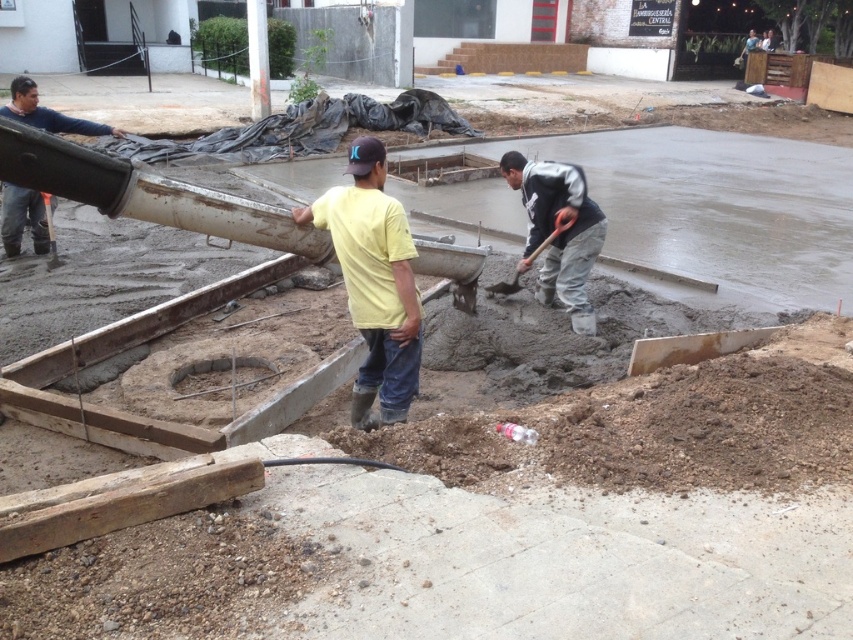
Looking at this image, you are a construction inspector examining the site from a safe distance. You notice two points marked on the concrete pour area. Which point, point [352,227] or point [587,333], is closer to your current position?

Point [352,227] is closer to the camera than point [587,333], so the point closer to your position is point [352,227].

You are a safety inspector at the construction site. You notice the yellow matte shirt at center and the gray concrete shovel at center. Which object is taller?

The yellow matte shirt at center is taller than the gray concrete shovel at center.

You are a safety inspector at the construction site. You need to ensure that the yellow matte shirt at center and the metallic gray shovel at center are visible to each other. Since the yellow matte shirt is wider than the shovel, which object would block the other from view if positioned directly in front?

The yellow matte shirt at center is wider than the metallic gray shovel at center, so if positioned directly in front, the yellow matte shirt at center would block the view of the metallic gray shovel at center.